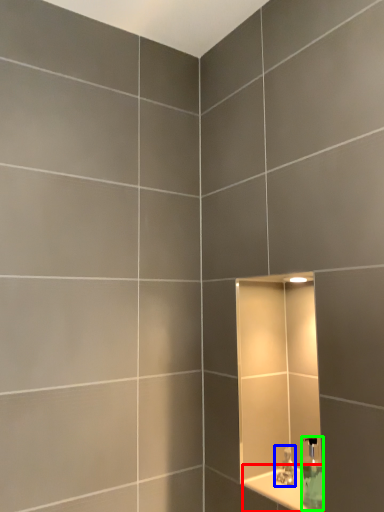
Question: Which object is the farthest from ledge (highlighted by a red box)? Choose among these: tap (highlighted by a blue box) or soap dispenser (highlighted by a green box).

Choices:
 (A) tap
 (B) soap dispenser

Answer: (B)